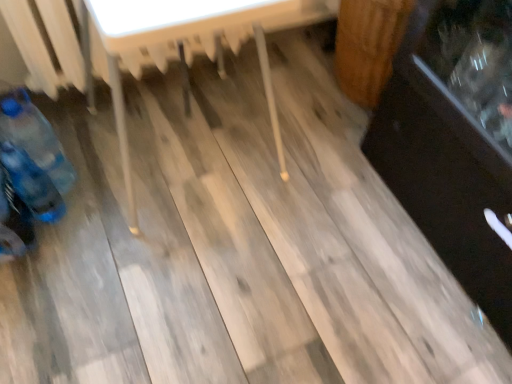
Locate an element on the screen. This screenshot has height=384, width=512. vacant region under wooden table at center (from a real-world perspective) is located at coordinates (183, 154).